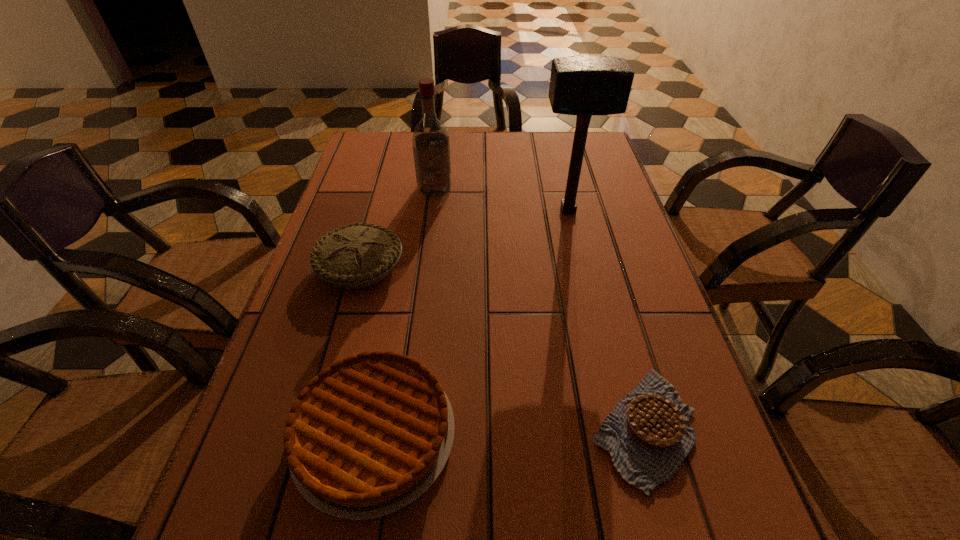
Identify the location of vacant space that satisfies the following two spatial constraints: 1. on the front-facing side of the mallet; 2. on the left side of the fourth shortest object. (432, 210).

Where is `vacant space that satisfies the following two spatial constraints: 1. on the front-facing side of the shortest pie; 2. on the right side of the farthest object`? vacant space that satisfies the following two spatial constraints: 1. on the front-facing side of the shortest pie; 2. on the right side of the farthest object is located at coordinates (404, 428).